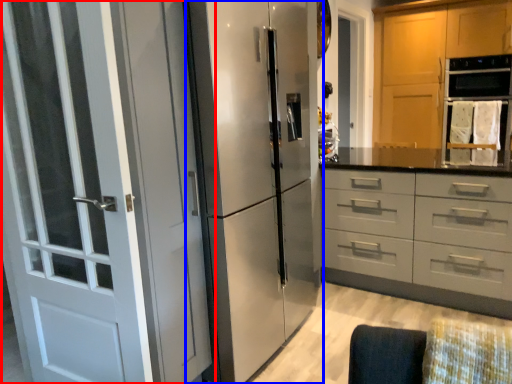
Question: Which point is further to the camera, door (highlighted by a red box) or refrigerator (highlighted by a blue box)?

Choices:
 (A) door
 (B) refrigerator

Answer: (B)